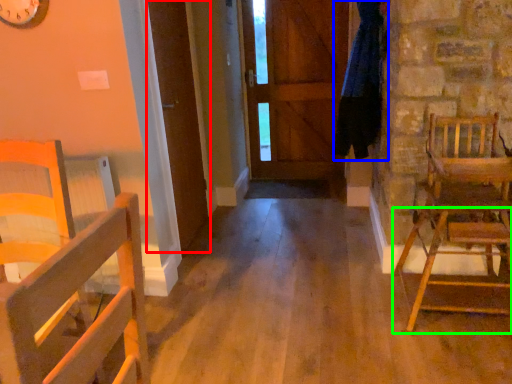
Question: Considering the real-world distances, which object is closest to door (highlighted by a red box)? clothesline (highlighted by a blue box) or chair (highlighted by a green box).

Choices:
 (A) clothesline
 (B) chair

Answer: (A)